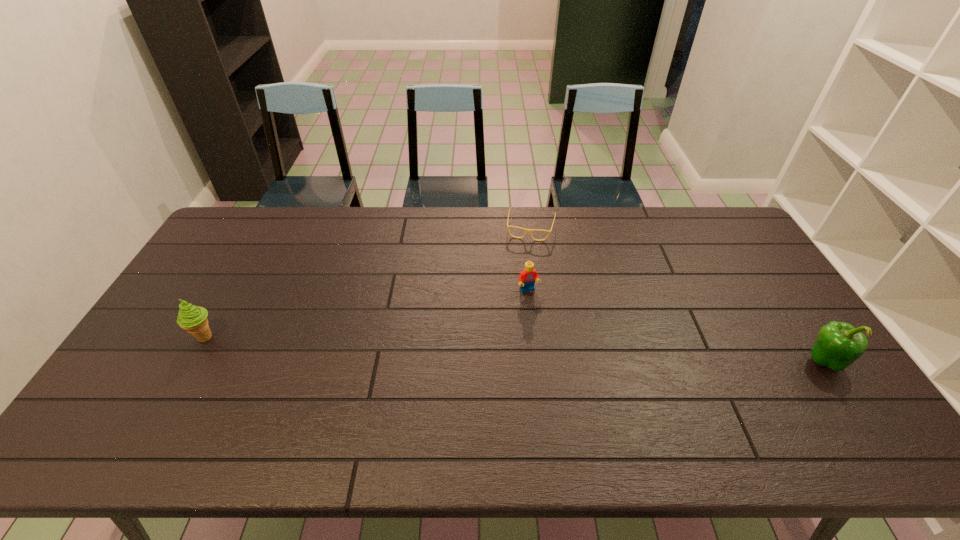
Where is `empty space that is in between the bell pepper and the third tallest object`? The image size is (960, 540). empty space that is in between the bell pepper and the third tallest object is located at coordinates (676, 326).

Point out which object is positioned as the third nearest to the bell pepper. Please provide its 2D coordinates. Your answer should be formatted as a tuple, i.e. [(x, y)], where the tuple contains the x and y coordinates of a point satisfying the conditions above.

[(193, 319)]

Choose which object is the second nearest neighbor to the leftmost object. Please provide its 2D coordinates. Your answer should be formatted as a tuple, i.e. [(x, y)], where the tuple contains the x and y coordinates of a point satisfying the conditions above.

[(526, 230)]

Where is `free space that satisfies the following two spatial constraints: 1. on the front side of the rightmost object; 2. on the left side of the leftmost object`? This screenshot has width=960, height=540. free space that satisfies the following two spatial constraints: 1. on the front side of the rightmost object; 2. on the left side of the leftmost object is located at coordinates (192, 361).